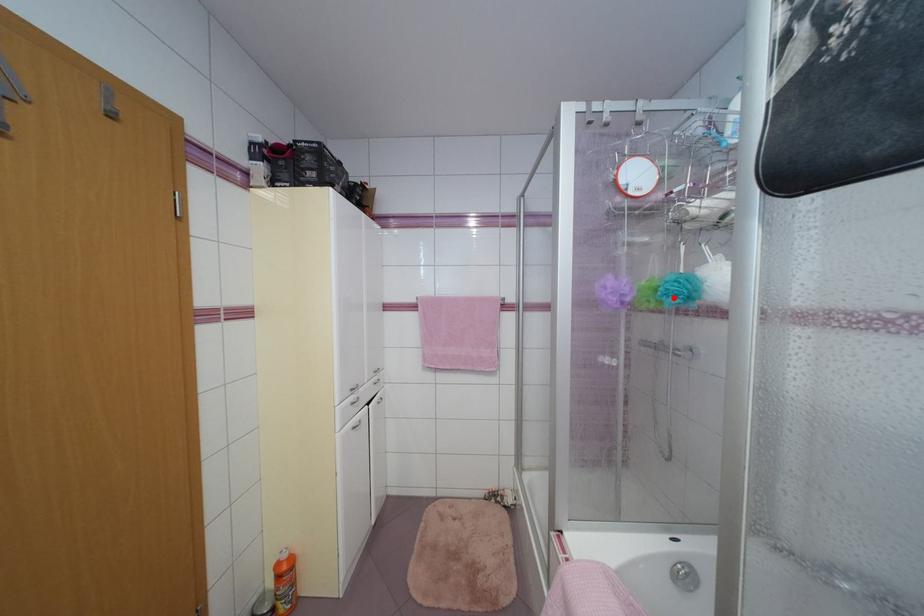
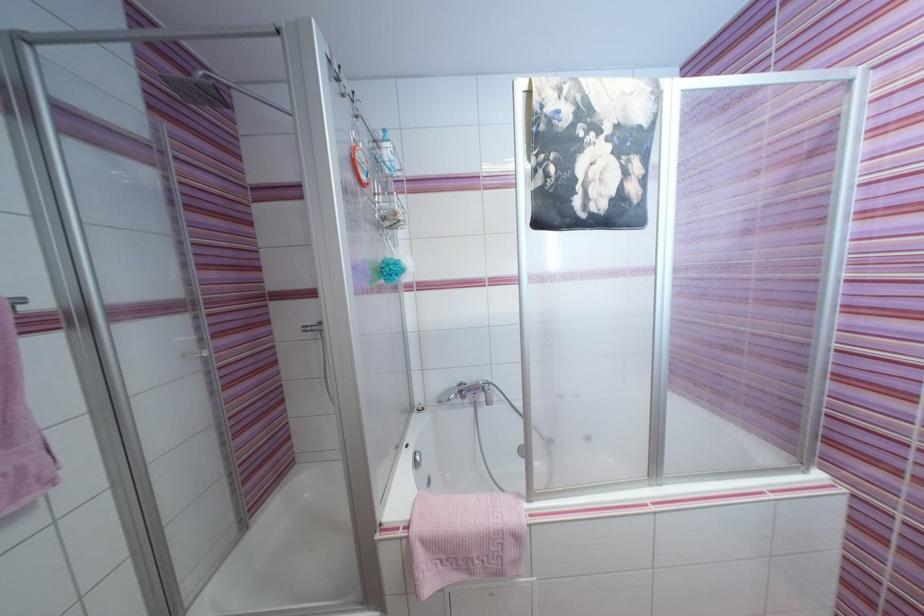
The point at the highlighted location is marked in the first image. Where is the corresponding point in the second image?

(395, 277)